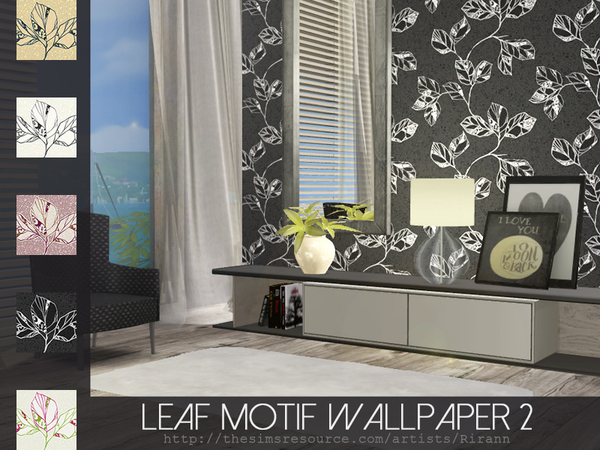
The height and width of the screenshot is (450, 600). What are the coordinates of `floor` in the screenshot? It's located at (178, 317).